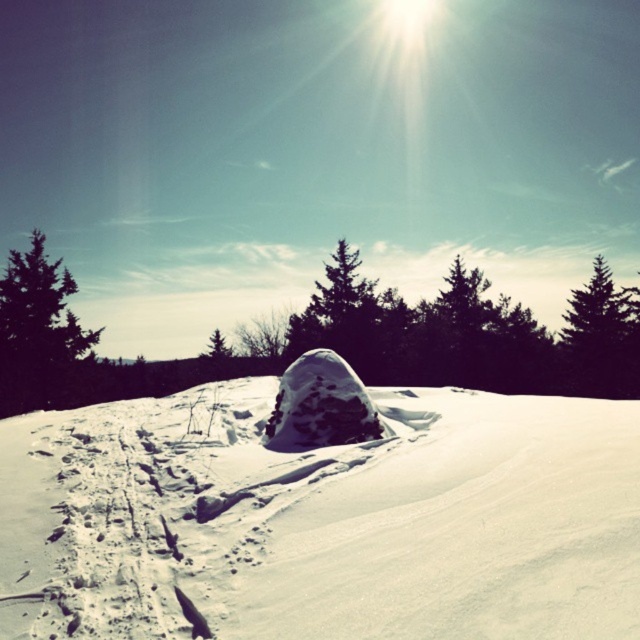
You are standing in the winter landscape and want to take a photo. There are two points marked in the image. The first point is at coordinate point (506, 621) and the second point is at coordinate point (29, 401). Which point is closer to your camera?

Point (506, 621) is closer to the camera than point (29, 401).